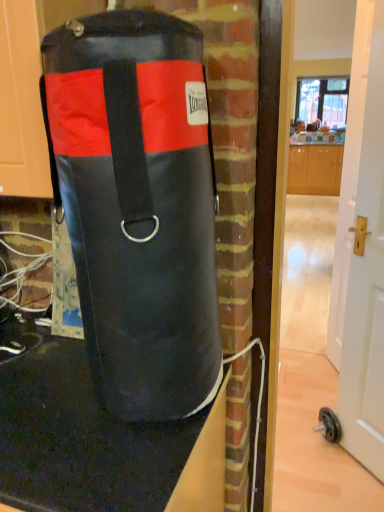
The width and height of the screenshot is (384, 512). In order to click on vacant position to the left of black leather punching bag at center in this screenshot , I will do `click(46, 400)`.